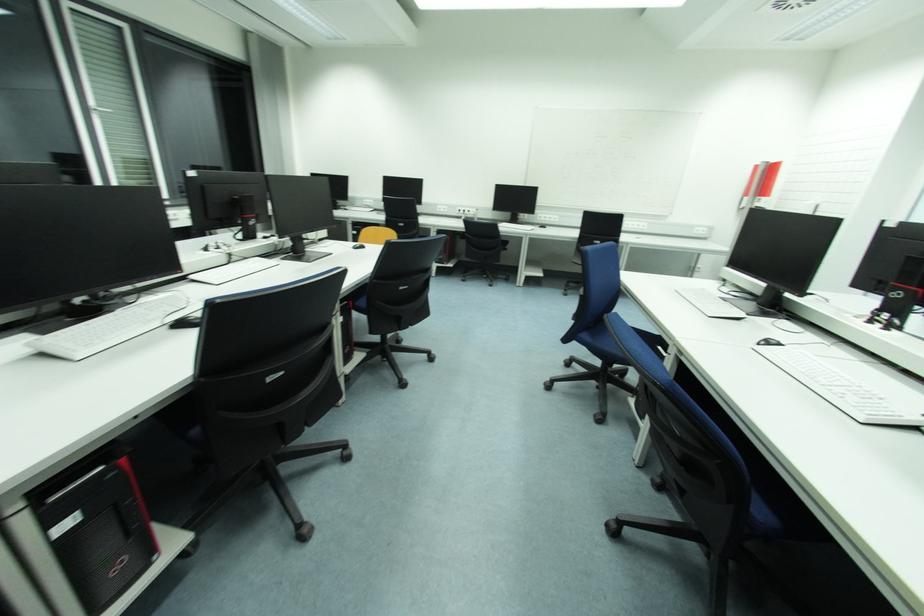
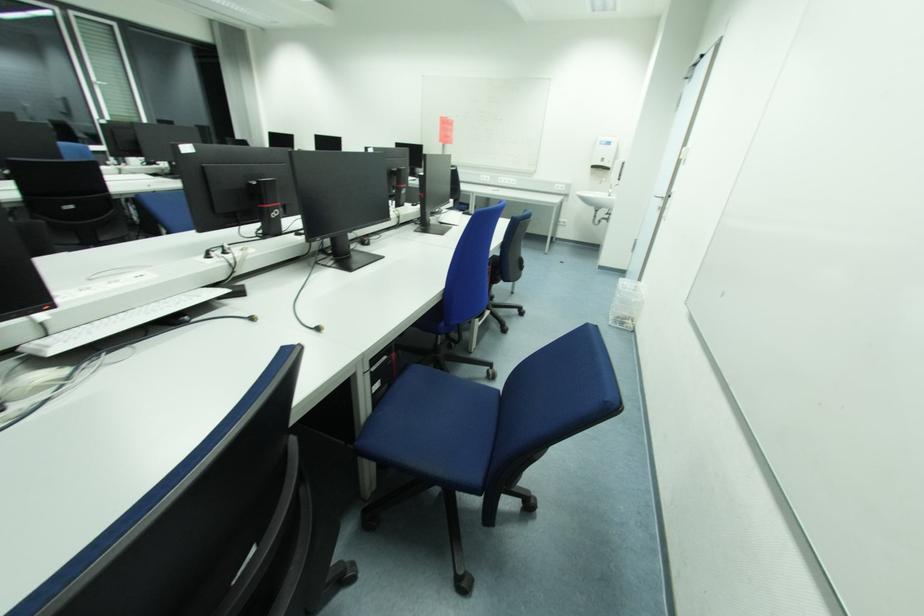
Question: In a continuous first-person perspective shot, in which direction is the camera moving?

Choices:
 (A) Left
 (B) Right
 (C) Forward
 (D) Backward

Answer: (B)